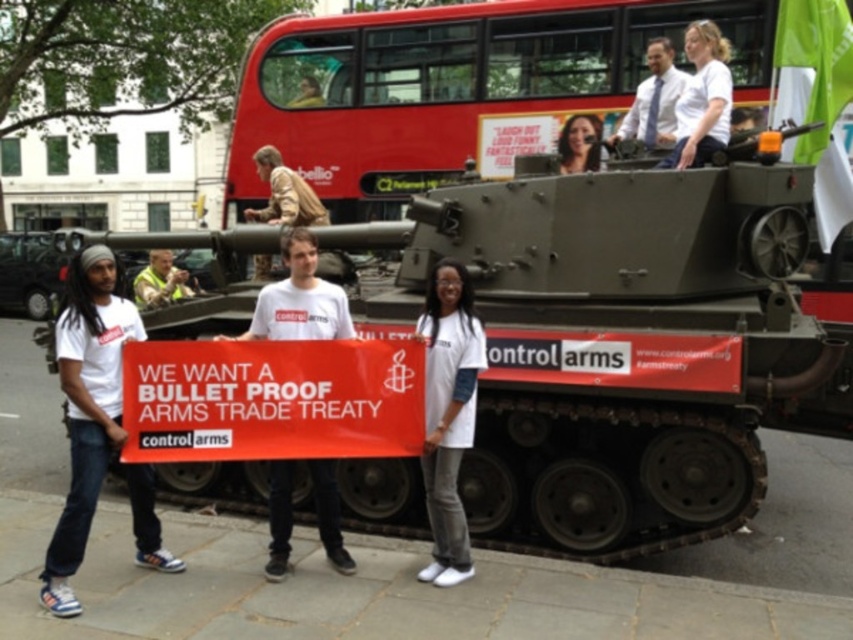
Question: Observing the image, what is the correct spatial positioning of red painted metal decker bus at upper center in reference to white cotton t-shirt at left?

Choices:
 (A) above
 (B) below

Answer: (A)

Question: Estimate the real-world distances between objects in this image. Which object is farther from the white cotton t-shirt at left?

Choices:
 (A) light blue shirt at upper center
 (B) red matte banner at center
 (C) white cotton shirt at upper center
 (D) white cotton shirt at center

Answer: (A)

Question: Can you confirm if white cotton shirt at center is thinner than smooth skin face at upper center?

Choices:
 (A) yes
 (B) no

Answer: (A)

Question: Among these objects, which one is farthest from the camera?

Choices:
 (A) smooth skin face at upper center
 (B) white cotton t-shirt at left
 (C) light blue shirt at upper center

Answer: (A)

Question: Is red matte banner at center bigger than white cotton shirt at center?

Choices:
 (A) no
 (B) yes

Answer: (A)

Question: Which of the following is the farthest from the observer?

Choices:
 (A) (747, 470)
 (B) (358, 22)
 (C) (461, 545)

Answer: (B)